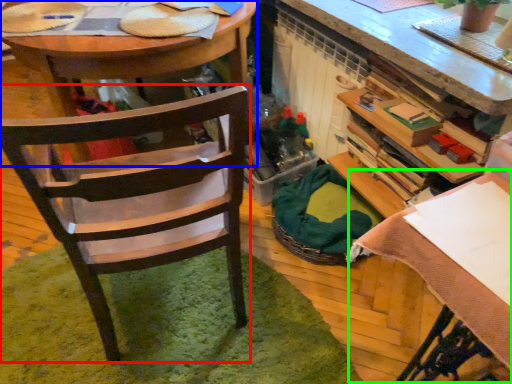
Question: Based on their relative distances, which object is farther from chair (highlighted by a red box)? Choose from desk (highlighted by a blue box) and table (highlighted by a green box).

Choices:
 (A) desk
 (B) table

Answer: (B)